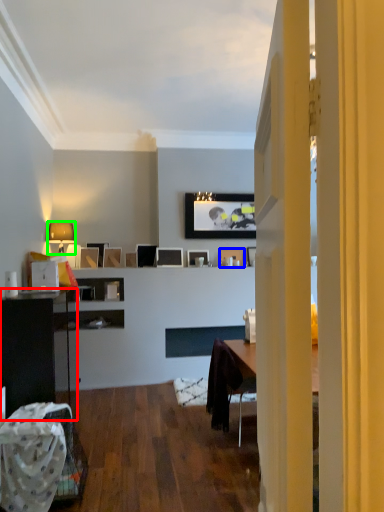
Question: Which object is the closest to the cabinetry (highlighted by a red box)? Choose among these: picture frame (highlighted by a blue box) or lamp (highlighted by a green box).

Choices:
 (A) picture frame
 (B) lamp

Answer: (B)